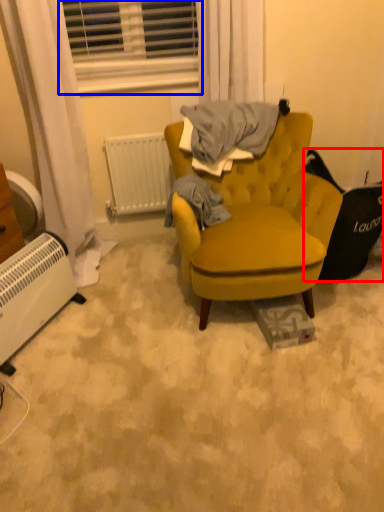
Question: Which point is closer to the camera, swivel chair (highlighted by a red box) or window (highlighted by a blue box)?

Choices:
 (A) swivel chair
 (B) window

Answer: (A)